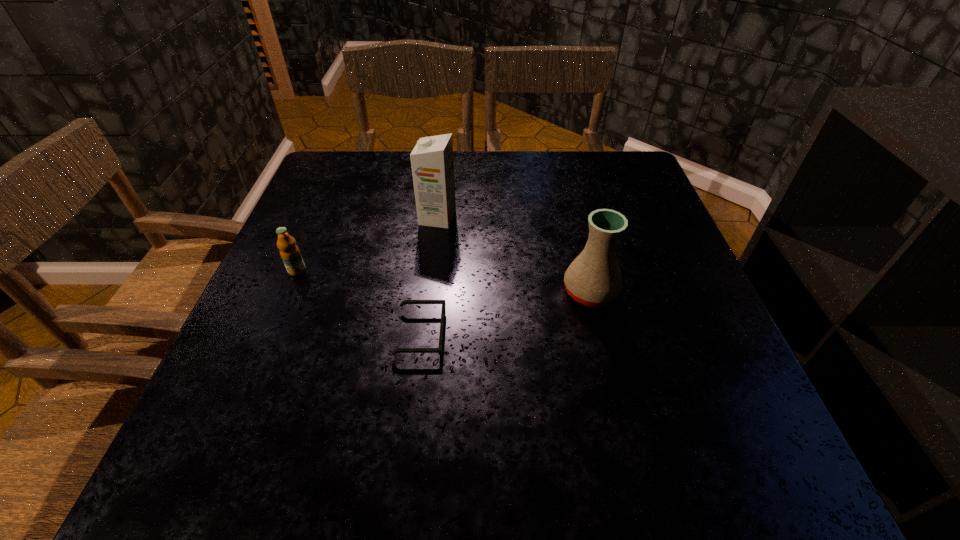
Locate an element on the screen. carton is located at coordinates (432, 162).

Identify the location of pottery. The width and height of the screenshot is (960, 540). (594, 279).

The height and width of the screenshot is (540, 960). I want to click on orange juice, so click(289, 251).

Find the location of a particular element. the third tallest object is located at coordinates (289, 251).

Locate an element on the screen. the shortest object is located at coordinates (439, 350).

You are a GUI agent. You are given a task and a screenshot of the screen. Output one action in this format:
    pyautogui.click(x=<x>, y=<y>)
    Task: Click on the vacant space located 0.280m on the right of the farthest object
    
    Given the screenshot: What is the action you would take?
    pyautogui.click(x=570, y=218)

Where is `blank space located 0.090m on the front of the rightmost object`? This screenshot has height=540, width=960. blank space located 0.090m on the front of the rightmost object is located at coordinates (605, 352).

Find the location of `free space located on the label of the orange juice`. free space located on the label of the orange juice is located at coordinates (282, 305).

The image size is (960, 540). What are the coordinates of `vacant region located on the front-facing side of the sunglasses` in the screenshot? It's located at (610, 334).

The width and height of the screenshot is (960, 540). Identify the location of object that is at the left edge. pyautogui.click(x=289, y=251).